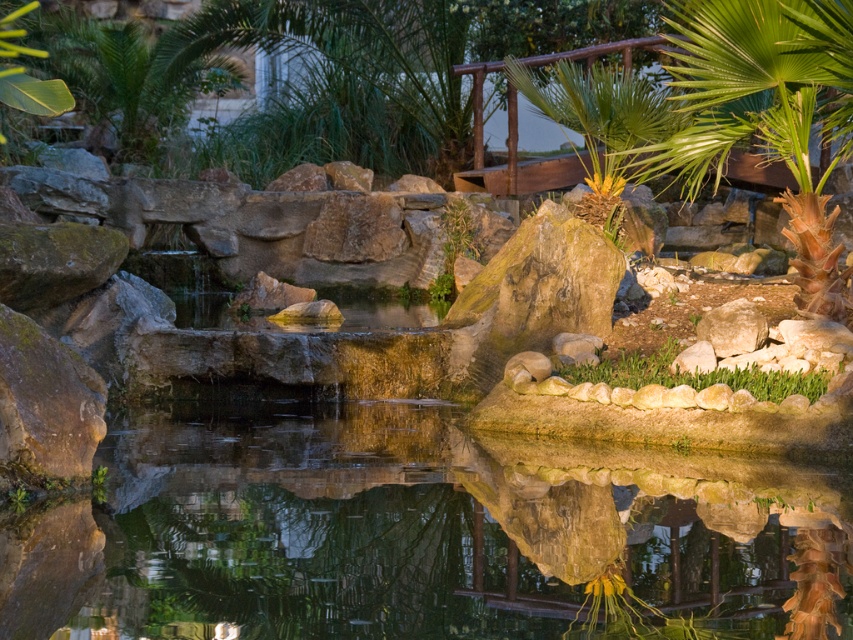
You are a gardener trying to plant a new flower in the garden. You see the clear water at center and the green grass at center. Which object is located below the other?

The clear water at center is positioned under the green grass at center, so the water is below the grass.

You are standing in the garden and see the clear water at center and the green grass at center. Which one is positioned to the left?

The clear water at center is to the left of the green grass at center.